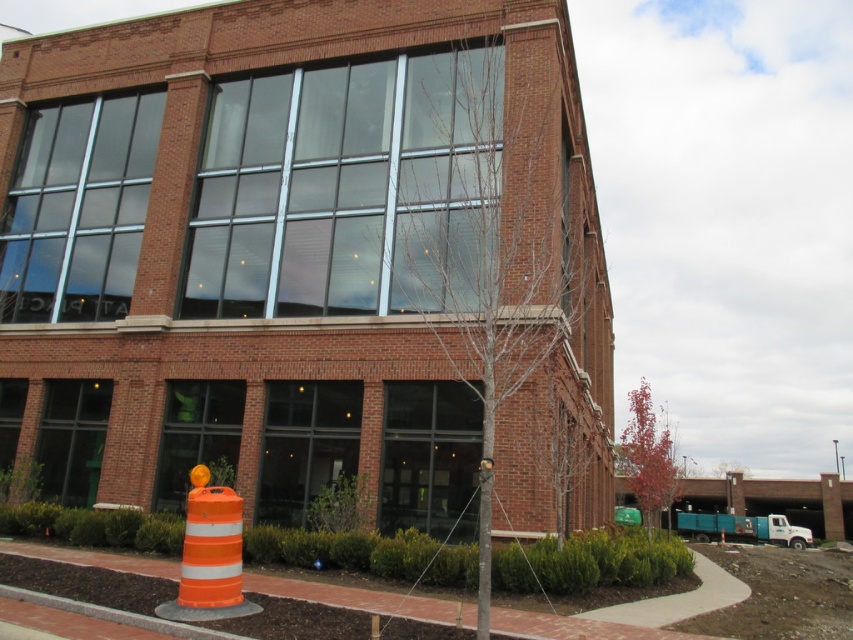
You are a delivery driver who needs to park your vehicle near the orange reflective cone at lower left and the orange reflective cone at center. Based on the scene, which cone requires more space to accommodate your parking? Please explain your reasoning.

The orange reflective cone at center requires more space because it occupies more space than the orange reflective cone at lower left according to the description.

You are a delivery driver who needs to park your vehicle 10 meters away from the orange reflective cone at lower left. Based on the scene, can you safely park your vehicle at the current position?

The orange reflective cone at lower left is 7.07 meters away from camera. Since the driver wants to park 10 meters away, they need to move further back to ensure the distance is met.